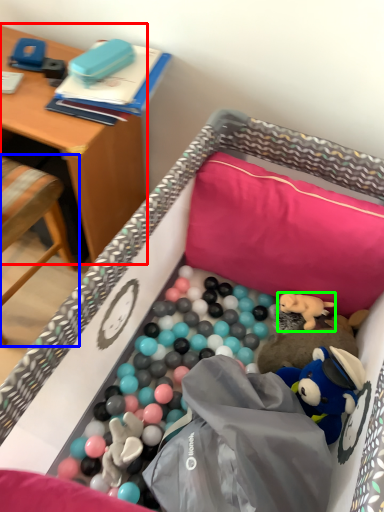
Question: Which object is the farthest from desk (highlighted by a red box)? Choose among these: chair (highlighted by a blue box) or toy (highlighted by a green box).

Choices:
 (A) chair
 (B) toy

Answer: (B)